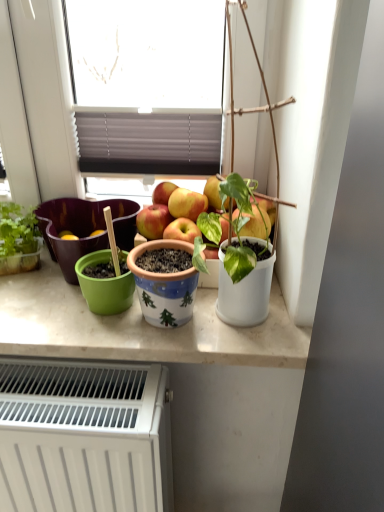
At what (x,y) coordinates should I click in order to perform the action: click on vacant area on top of white glossy countertop at center (from a real-world perspective). Please return your answer as a coordinate pair (x, y). Looking at the image, I should click on coord(119,309).